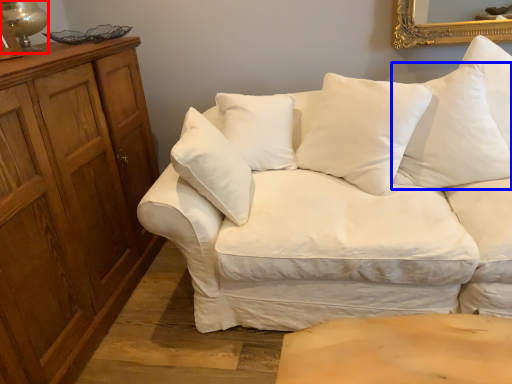
Question: Which object appears closest to the camera in this image, table lamp (highlighted by a red box) or pillow (highlighted by a blue box)?

Choices:
 (A) table lamp
 (B) pillow

Answer: (B)